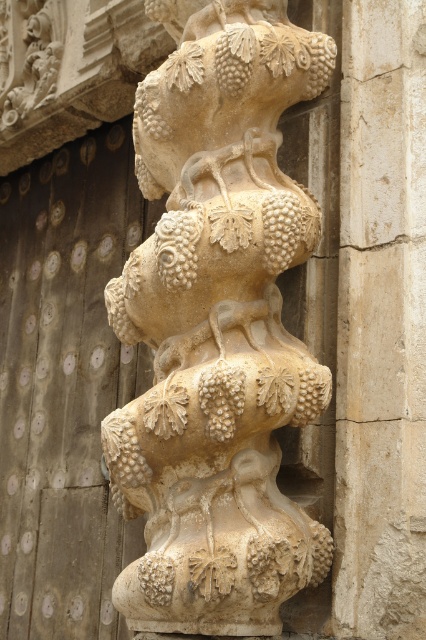
Between beige stone grapes at center and beige stone column at center, which one is positioned higher?

beige stone grapes at center is above.

Does beige stone grapes at center appear over beige stone column at center?

Indeed, beige stone grapes at center is positioned over beige stone column at center.

Describe the element at coordinates (218, 326) in the screenshot. Image resolution: width=426 pixels, height=640 pixels. I see `beige stone grapes at center` at that location.

Where is `beige stone grapes at center`? The image size is (426, 640). beige stone grapes at center is located at coordinates (218, 326).